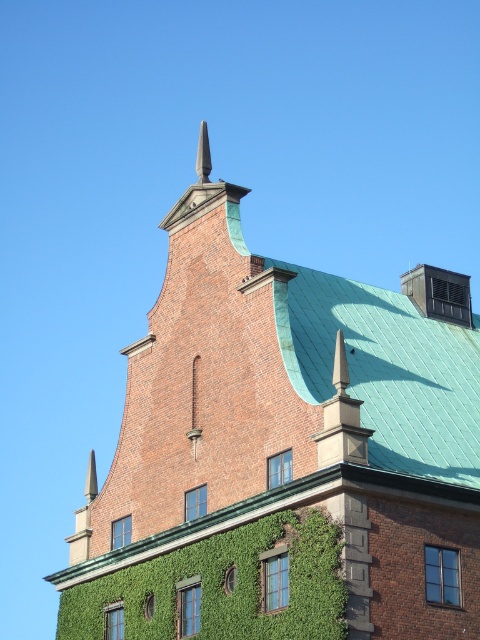
Question: Which point appears farthest from the camera in this image?

Choices:
 (A) (324, 524)
 (B) (83, 524)

Answer: (B)

Question: Does brick tower at center have a larger size compared to green ivy at center?

Choices:
 (A) no
 (B) yes

Answer: (B)

Question: Is brick tower at center thinner than green ivy at center?

Choices:
 (A) no
 (B) yes

Answer: (A)

Question: Which of the following is the closest to the observer?

Choices:
 (A) brick tower at center
 (B) green ivy at center

Answer: (B)

Question: Does brick tower at center have a lesser width compared to green ivy at center?

Choices:
 (A) no
 (B) yes

Answer: (A)